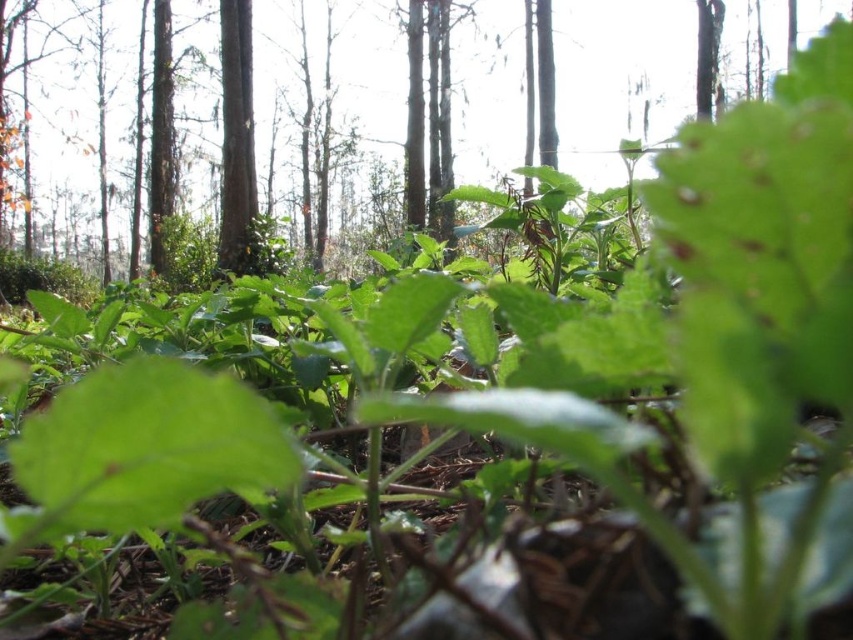
Question: Can you confirm if green leafy plant at center is smaller than smooth brown tree trunk at upper center?

Choices:
 (A) no
 (B) yes

Answer: (A)

Question: Which point appears closest to the camera in this image?

Choices:
 (A) (469, 20)
 (B) (239, 172)

Answer: (B)

Question: Which of the following is the closest to the observer?

Choices:
 (A) smooth brown tree trunk at upper center
 (B) green leafy plant at center

Answer: (B)

Question: Is green leafy plant at center to the right of smooth brown tree trunk at upper center from the viewer's perspective?

Choices:
 (A) yes
 (B) no

Answer: (A)

Question: Considering the relative positions of green leafy plant at center and smooth brown tree trunk at upper center in the image provided, where is green leafy plant at center located with respect to smooth brown tree trunk at upper center?

Choices:
 (A) above
 (B) below

Answer: (B)